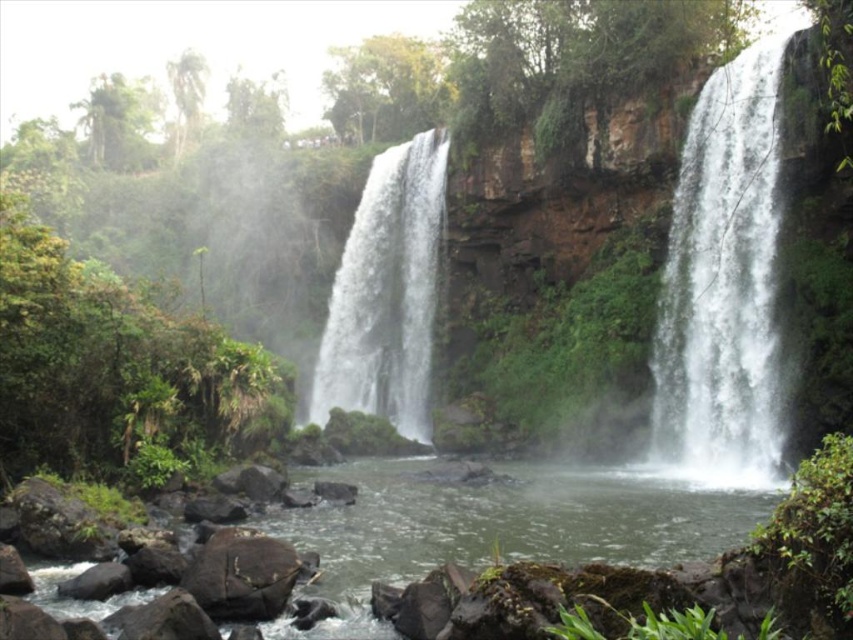
Question: Where is white frothy water at right located in relation to white frothy water at center in the image?

Choices:
 (A) below
 (B) above

Answer: (B)

Question: Which of the following is the closest to the observer?

Choices:
 (A) gray rock at lower left
 (B) brown rough rock at lower left
 (C) white frothy water at right
 (D) white frothy water at center

Answer: (B)

Question: Is white frothy water at right to the right of gray rock at lower left from the viewer's perspective?

Choices:
 (A) no
 (B) yes

Answer: (B)

Question: Among these points, which one is farthest from the camera?

Choices:
 (A) (726, 353)
 (B) (368, 276)

Answer: (B)

Question: Is white frothy water at right positioned before gray rock at lower left?

Choices:
 (A) yes
 (B) no

Answer: (B)

Question: Which object is positioned farthest from the white frothy water at center?

Choices:
 (A) brown rough rock at lower left
 (B) green mossy rocks at center
 (C) white frothy water at right
 (D) gray rock at lower left

Answer: (A)